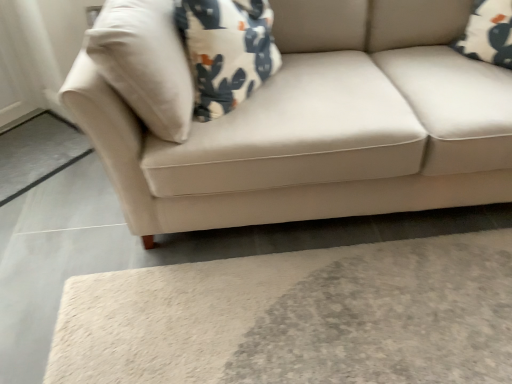
The height and width of the screenshot is (384, 512). Describe the element at coordinates (488, 33) in the screenshot. I see `white cotton pillow at upper right` at that location.

Measure the distance between white cotton pillow at upper right and camera.

white cotton pillow at upper right and camera are 1.52 meters apart.

Locate an element on the screen. white cotton pillow at upper right is located at coordinates (488, 33).

Where is `white cotton pillow at upper right`? This screenshot has height=384, width=512. white cotton pillow at upper right is located at coordinates (488, 33).